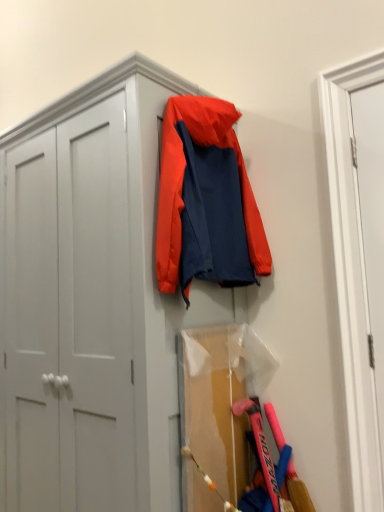
Find the location of a particular element. The height and width of the screenshot is (512, 384). white smooth door at right, acting as the 2th door starting from the left is located at coordinates (371, 234).

The height and width of the screenshot is (512, 384). Identify the location of matte white cabinet at upper left. (91, 303).

Is white smooth door at right, which ranks as the first door in right-to-left order, located outside orange fabric jacket at center?

white smooth door at right, which ranks as the first door in right-to-left order, lies outside orange fabric jacket at center's area.

Can you see white smooth door at right, acting as the 2th door starting from the left, touching orange fabric jacket at center?

No.

Relative to orange fabric jacket at center, is white smooth door at right, acting as the 2th door starting from the left, in front or behind?

white smooth door at right, acting as the 2th door starting from the left, is positioned farther from the viewer than orange fabric jacket at center.

From a real-world perspective, is white smooth door at right, acting as the 2th door starting from the left, located beneath orange fabric jacket at center?

Yes.

Between matte white cabinet at upper left and orange fabric jacket at center, which one has more height?

matte white cabinet at upper left.

From the image's perspective, would you say matte white cabinet at upper left is shown under orange fabric jacket at center?

Yes.

Is orange fabric jacket at center at the back of matte white cabinet at upper left?

matte white cabinet at upper left is not turned away from orange fabric jacket at center.

Considering the relative sizes of white matte door at right, positioned as the first door in left-to-right order, and matte white cabinet at upper left in the image provided, is white matte door at right, positioned as the first door in left-to-right order, taller than matte white cabinet at upper left?

In fact, white matte door at right, positioned as the first door in left-to-right order, may be shorter than matte white cabinet at upper left.

How much distance is there between white matte door at right, positioned as the first door in left-to-right order, and matte white cabinet at upper left?

91.74 centimeters.

Which object is closer to the camera, white matte door at right, positioned as the first door in left-to-right order, or matte white cabinet at upper left?

matte white cabinet at upper left is closer to the camera.

Is white matte door at right, which is the second door from right to left, inside the boundaries of matte white cabinet at upper left, or outside?

white matte door at right, which is the second door from right to left, is not enclosed by matte white cabinet at upper left.

In the scene shown: From a real-world perspective, does white smooth door at right, which ranks as the first door in right-to-left order, sit lower than white matte door at right, positioned as the first door in left-to-right order?

Yes, from a real-world perspective, white smooth door at right, which ranks as the first door in right-to-left order, is below white matte door at right, positioned as the first door in left-to-right order.

From the picture: Is white smooth door at right, acting as the 2th door starting from the left, facing towards white matte door at right, positioned as the first door in left-to-right order?

Yes, white smooth door at right, acting as the 2th door starting from the left, is aimed at white matte door at right, positioned as the first door in left-to-right order.

Considering the sizes of objects white smooth door at right, which ranks as the first door in right-to-left order, and white matte door at right, which is the second door from right to left, in the image provided, who is shorter, white smooth door at right, which ranks as the first door in right-to-left order, or white matte door at right, which is the second door from right to left,?

white smooth door at right, which ranks as the first door in right-to-left order.

From a real-world perspective, is orange fabric jacket at center positioned over white smooth door at right, acting as the 2th door starting from the left, based on gravity?

Indeed, from a real-world perspective, orange fabric jacket at center stands above white smooth door at right, acting as the 2th door starting from the left.

Can you confirm if orange fabric jacket at center is smaller than white smooth door at right, acting as the 2th door starting from the left?

No.

Which is more to the left, orange fabric jacket at center or white smooth door at right, acting as the 2th door starting from the left?

From the viewer's perspective, orange fabric jacket at center appears more on the left side.

At what (x,y) coordinates should I click in order to perform the action: click on door that is the 2nd object directly below the orange fabric jacket at center (from a real-world perspective). Please return your answer as a coordinate pair (x, y). This screenshot has height=512, width=384. Looking at the image, I should click on (371, 234).

Measure the distance between white matte door at right, which is the second door from right to left, and orange fabric jacket at center.

They are 19.14 inches apart.

Who is bigger, white matte door at right, positioned as the first door in left-to-right order, or orange fabric jacket at center?

orange fabric jacket at center is bigger.

From a real-world perspective, between white matte door at right, positioned as the first door in left-to-right order, and orange fabric jacket at center, who is vertically higher?

orange fabric jacket at center.

Does white matte door at right, which is the second door from right to left, turn towards orange fabric jacket at center?

No, white matte door at right, which is the second door from right to left, is not turned towards orange fabric jacket at center.

What's the angular difference between orange fabric jacket at center and matte white cabinet at upper left's facing directions?

The facing directions of orange fabric jacket at center and matte white cabinet at upper left are 0.885 degrees apart.

Is point (191, 101) positioned in front of point (173, 347)?

No, it is behind (173, 347).

From the image's perspective, is orange fabric jacket at center below matte white cabinet at upper left?

Actually, orange fabric jacket at center appears above matte white cabinet at upper left in the image.

Is matte white cabinet at upper left surrounded by orange fabric jacket at center?

No.

Identify the location of jacket positioned vertically above the white smooth door at right, acting as the 2th door starting from the left (from a real-world perspective). This screenshot has height=512, width=384. (182, 182).

Where is `cabinetry that is on the left side of orange fabric jacket at center`? This screenshot has height=512, width=384. cabinetry that is on the left side of orange fabric jacket at center is located at coordinates (91, 303).

Estimate the real-world distances between objects in this image. Which object is closer to white smooth door at right, which ranks as the first door in right-to-left order, orange fabric jacket at center or matte white cabinet at upper left?

Among the two, orange fabric jacket at center is located nearer to white smooth door at right, which ranks as the first door in right-to-left order.

Based on their spatial positions, is matte white cabinet at upper left or white smooth door at right, acting as the 2th door starting from the left, further from orange fabric jacket at center?

Based on the image, white smooth door at right, acting as the 2th door starting from the left, appears to be further to orange fabric jacket at center.

When comparing their distances from white matte door at right, positioned as the first door in left-to-right order, does orange fabric jacket at center or matte white cabinet at upper left seem closer?

Based on the image, orange fabric jacket at center appears to be nearer to white matte door at right, positioned as the first door in left-to-right order.

Which object lies further to the anchor point matte white cabinet at upper left, white smooth door at right, which ranks as the first door in right-to-left order, or white matte door at right, which is the second door from right to left?

white smooth door at right, which ranks as the first door in right-to-left order, lies further to matte white cabinet at upper left than the other object.

Looking at this image, when comparing their distances from matte white cabinet at upper left, does white matte door at right, which is the second door from right to left, or orange fabric jacket at center seem closer?

The object closer to matte white cabinet at upper left is orange fabric jacket at center.

When comparing their distances from matte white cabinet at upper left, does white smooth door at right, acting as the 2th door starting from the left, or orange fabric jacket at center seem further?

white smooth door at right, acting as the 2th door starting from the left.

Looking at the image, which one is located further to matte white cabinet at upper left, orange fabric jacket at center or white matte door at right, which is the second door from right to left?

Based on the image, white matte door at right, which is the second door from right to left, appears to be further to matte white cabinet at upper left.

Estimate the real-world distances between objects in this image. Which object is further from white matte door at right, positioned as the first door in left-to-right order, white smooth door at right, acting as the 2th door starting from the left, or matte white cabinet at upper left?

matte white cabinet at upper left is positioned further to the anchor white matte door at right, positioned as the first door in left-to-right order.

At what (x,y) coordinates should I click in order to perform the action: click on door situated between orange fabric jacket at center and white smooth door at right, which ranks as the first door in right-to-left order, from left to right. Please return your answer as a coordinate pair (x, y). The image size is (384, 512). Looking at the image, I should click on (352, 275).

I want to click on door located between matte white cabinet at upper left and white smooth door at right, acting as the 2th door starting from the left, in the left-right direction, so click(352, 275).

Where is `jacket between matte white cabinet at upper left and white smooth door at right, acting as the 2th door starting from the left, in the horizontal direction`? jacket between matte white cabinet at upper left and white smooth door at right, acting as the 2th door starting from the left, in the horizontal direction is located at coordinates (182, 182).

Identify the location of jacket between matte white cabinet at upper left and white matte door at right, positioned as the first door in left-to-right order, from left to right. This screenshot has width=384, height=512. (182, 182).